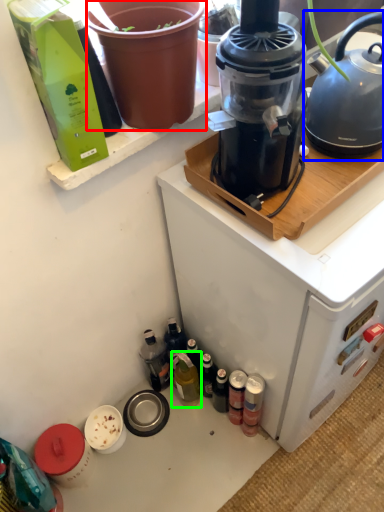
Question: Which object is positioned farthest from flowerpot (highlighted by a red box)? Select from kettle (highlighted by a blue box) and bottle (highlighted by a green box).

Choices:
 (A) kettle
 (B) bottle

Answer: (B)